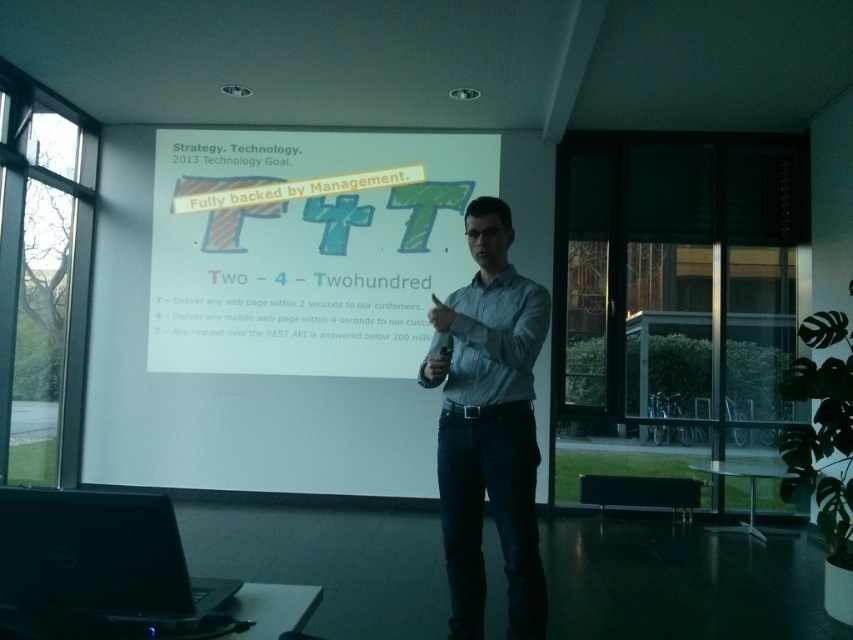
Is the position of white matte projection screen at center more distant than that of denim jeans at center?

Yes.

This screenshot has height=640, width=853. I want to click on white matte projection screen at center, so click(x=306, y=250).

This screenshot has height=640, width=853. Find the location of `white matte projection screen at center`. white matte projection screen at center is located at coordinates (306, 250).